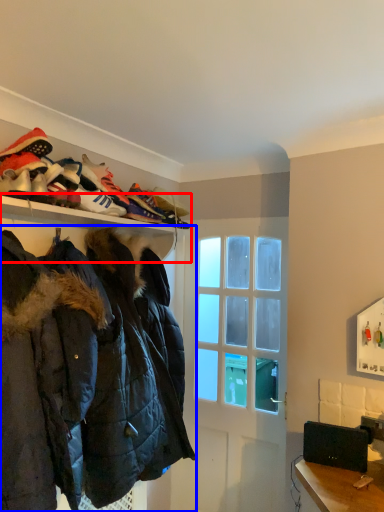
Question: Which of the following is the farthest to the observer, shelf (highlighted by a red box) or jacket (highlighted by a blue box)?

Choices:
 (A) shelf
 (B) jacket

Answer: (A)